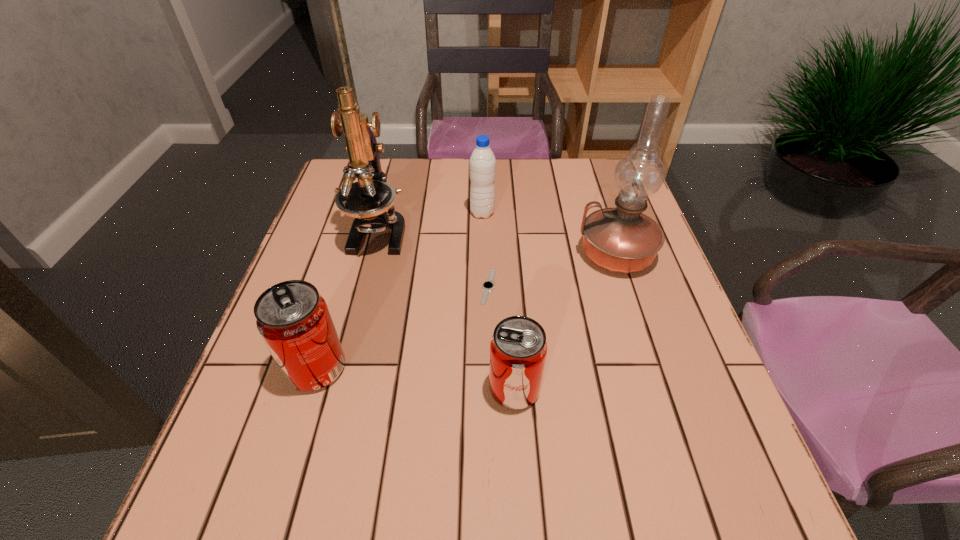
Where is `vacant region located on the front of the water bottle`? vacant region located on the front of the water bottle is located at coordinates (483, 258).

In order to click on free spot located on the left of the oil lamp in this screenshot , I will do `click(417, 254)`.

Image resolution: width=960 pixels, height=540 pixels. What are the coordinates of `vacant region located 0.070m at the eyepiece of the microscope` in the screenshot? It's located at (366, 284).

At what (x,y) coordinates should I click in order to perform the action: click on vacant area located on the right of the shortest object. Please return your answer as a coordinate pair (x, y). Looking at the image, I should click on (574, 287).

Identify the location of object present at the near edge. Image resolution: width=960 pixels, height=540 pixels. (518, 348).

The height and width of the screenshot is (540, 960). Find the location of `pop soda that is at the left edge`. pop soda that is at the left edge is located at coordinates (293, 319).

You are a GUI agent. You are given a task and a screenshot of the screen. Output one action in this format:
    pyautogui.click(x=<x>, y=<y>)
    Task: Click on the microscope that is at the left edge
    The height and width of the screenshot is (540, 960).
    Given the screenshot: What is the action you would take?
    pyautogui.click(x=370, y=201)

Where is `object situated at the right edge`? object situated at the right edge is located at coordinates (623, 240).

The height and width of the screenshot is (540, 960). I want to click on free region at the far edge, so click(528, 193).

The width and height of the screenshot is (960, 540). Identify the location of vacant space at the left edge of the desktop. (340, 230).